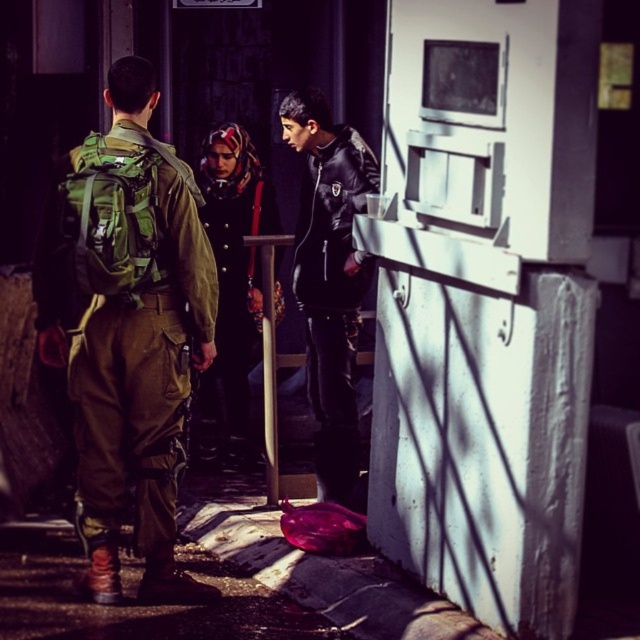
You are a photographer positioned at point (330, 276). You want to capture the black leather jacket at center in your shot. Which direction should you move to ensure it stays in the frame while avoiding the soldier on the left?

The black leather jacket at center is located at your current position, so you don not need to move. To avoid the soldier on the left, move slightly to the right or backward to keep the jacket in frame while maintaining distance from the soldier.

You are a photographer positioned to the right of the scene. You need to capture a photo where both the green military uniform at left and the black leather jacket at center are clearly visible. Based on their positions, which subject should you focus on first to ensure both are in frame?

The green military uniform at left is below the black leather jacket at center, so focusing on the black leather jacket at center first will ensure both are in frame as the green military uniform at left is positioned lower.